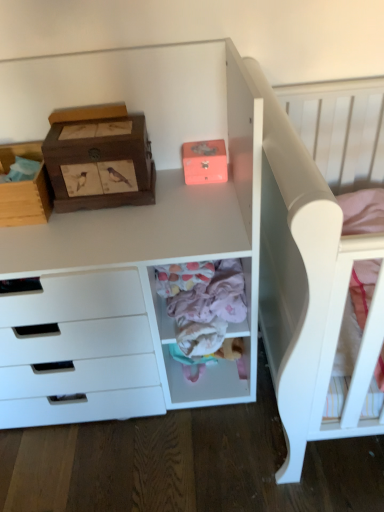
Locate an element on the screen. free spot in front of pastel pink fabric at lower center is located at coordinates (210, 419).